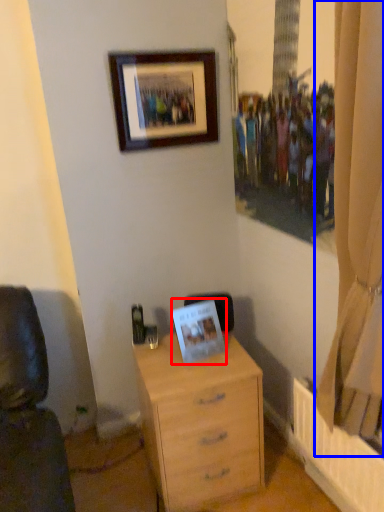
Question: Among these objects, which one is nearest to the camera, picture frame (highlighted by a red box) or curtain (highlighted by a blue box)?

Choices:
 (A) picture frame
 (B) curtain

Answer: (B)